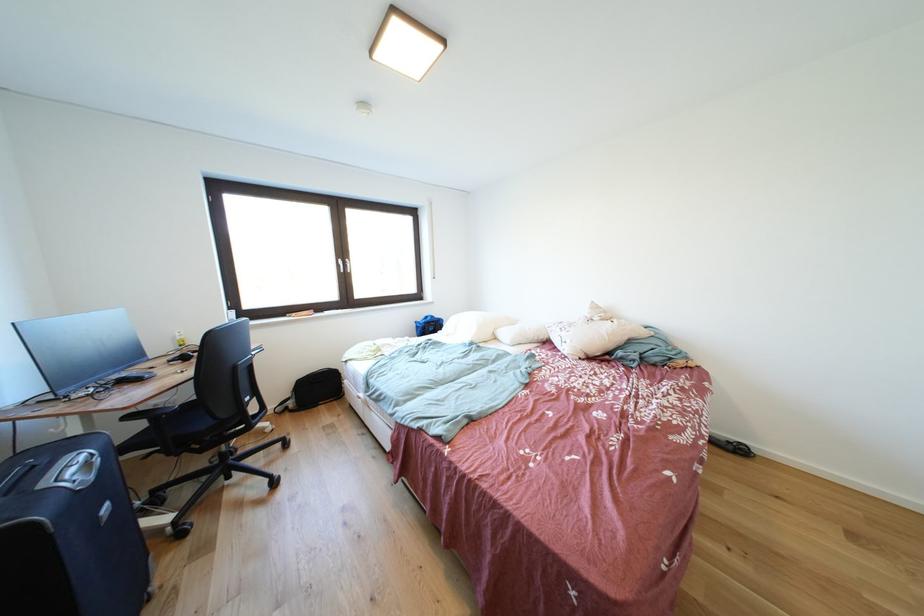
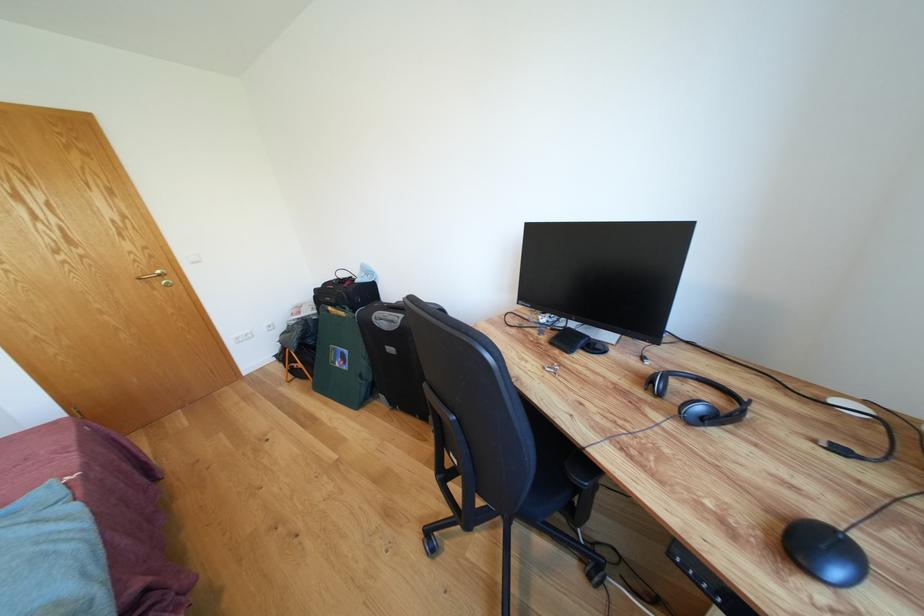
The point at (91, 463) is marked in the first image. Where is the corresponding point in the second image?

(398, 322)